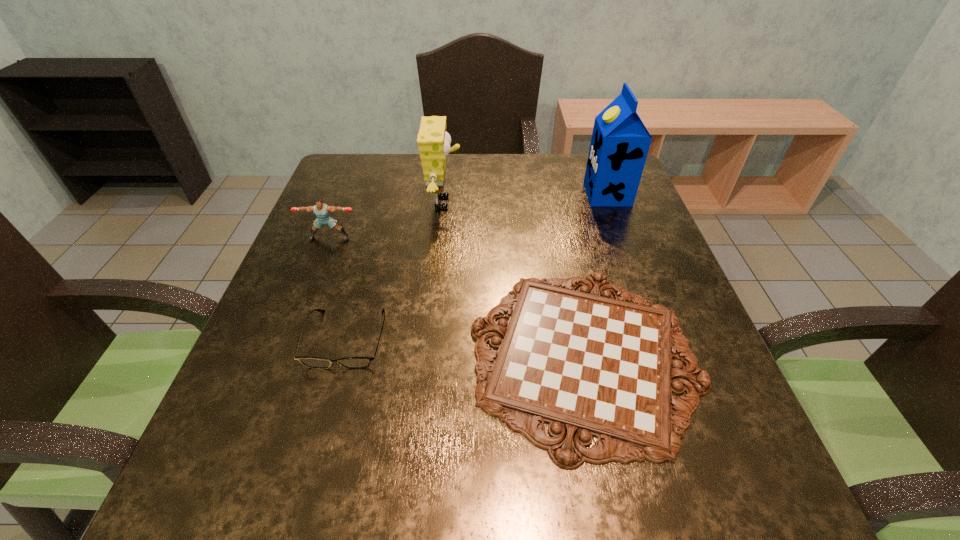
This screenshot has width=960, height=540. What are the coordinates of `free space between the chessboard and the puncher` in the screenshot? It's located at (x=457, y=296).

Locate an element on the screen. Image resolution: width=960 pixels, height=540 pixels. free space between the chessboard and the fourth tallest object is located at coordinates (465, 347).

I want to click on unoccupied position between the third object from right to left and the third shortest object, so click(387, 220).

The height and width of the screenshot is (540, 960). Identify the location of empty space between the puncher and the tallest object. (468, 216).

I want to click on free space between the third tallest object and the carton, so click(x=468, y=216).

You are a GUI agent. You are given a task and a screenshot of the screen. Output one action in this format:
    pyautogui.click(x=<x>, y=<y>)
    Task: Click on the free space between the spectacles and the tallest object
    Image resolution: width=960 pixels, height=540 pixels.
    Given the screenshot: What is the action you would take?
    476,267

You are a GUI agent. You are given a task and a screenshot of the screen. Output one action in this format:
    pyautogui.click(x=<x>, y=<y>)
    Task: Click on the free space between the third nearest object and the sponge
    
    Given the screenshot: What is the action you would take?
    pyautogui.click(x=387, y=220)

What are the coordinates of `object that is the fourth nearest to the carton` in the screenshot? It's located at (311, 362).

Locate which object is the closest to the chessboard. Please provide its 2D coordinates. Your answer should be formatted as a tuple, i.e. [(x, y)], where the tuple contains the x and y coordinates of a point satisfying the conditions above.

[(433, 141)]

Identify the location of free point that satisfies the following two spatial constraints: 1. with the cap open on the carton; 2. on the front-facing side of the spectacles. (660, 339).